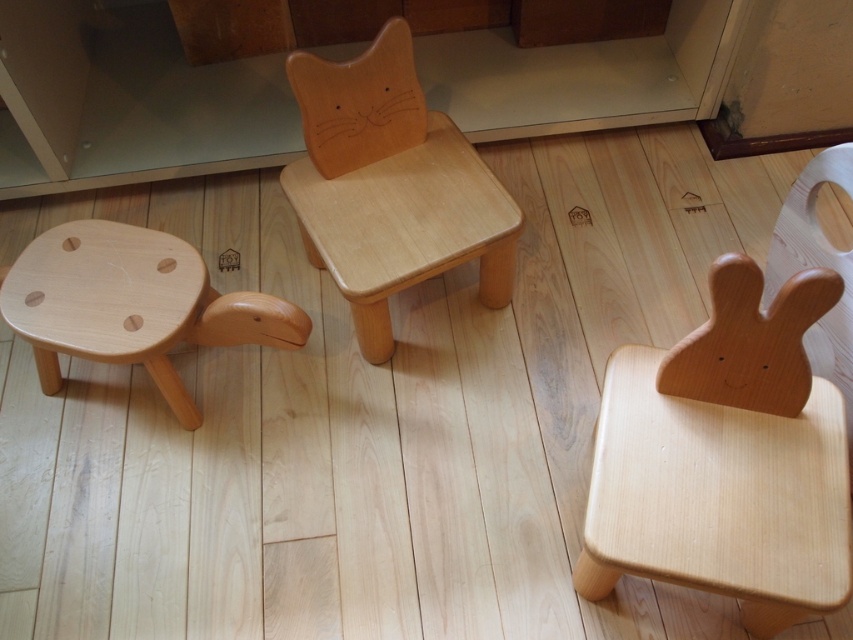
Question: Which point appears farthest from the camera in this image?

Choices:
 (A) (219, 342)
 (B) (498, 272)
 (C) (595, 465)

Answer: (B)

Question: Can you confirm if natural wood rabbit chair at right is bigger than natural wood stool at left?

Choices:
 (A) no
 (B) yes

Answer: (B)

Question: Does natural wood cat-shaped chair at center lie behind natural wood stool at left?

Choices:
 (A) no
 (B) yes

Answer: (B)

Question: Is natural wood rabbit chair at right positioned before natural wood stool at left?

Choices:
 (A) yes
 (B) no

Answer: (A)

Question: Among these points, which one is farthest from the camera?

Choices:
 (A) (802, 513)
 (B) (354, 257)

Answer: (B)

Question: Which is farther from the natural wood cat-shaped chair at center?

Choices:
 (A) natural wood stool at left
 (B) natural wood rabbit chair at right

Answer: (B)